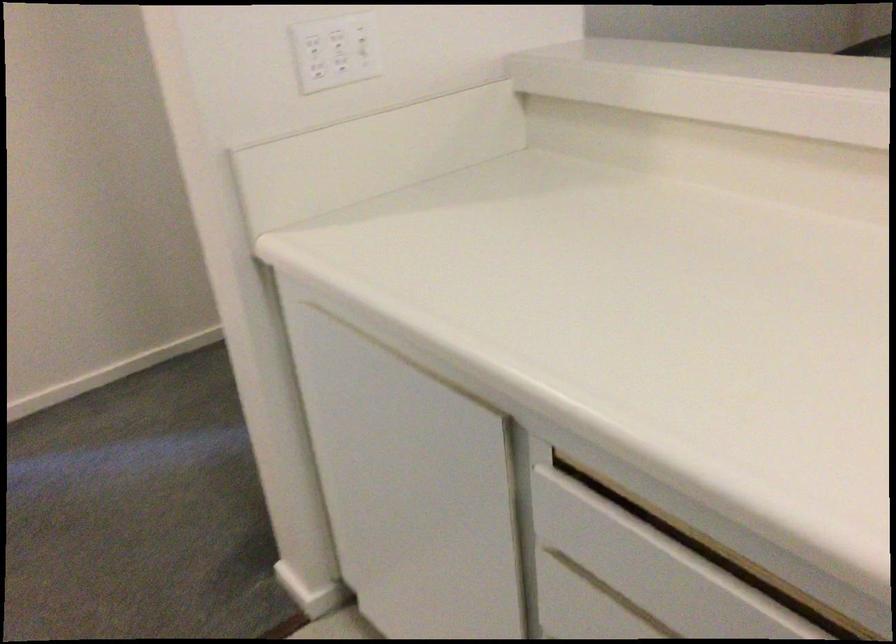
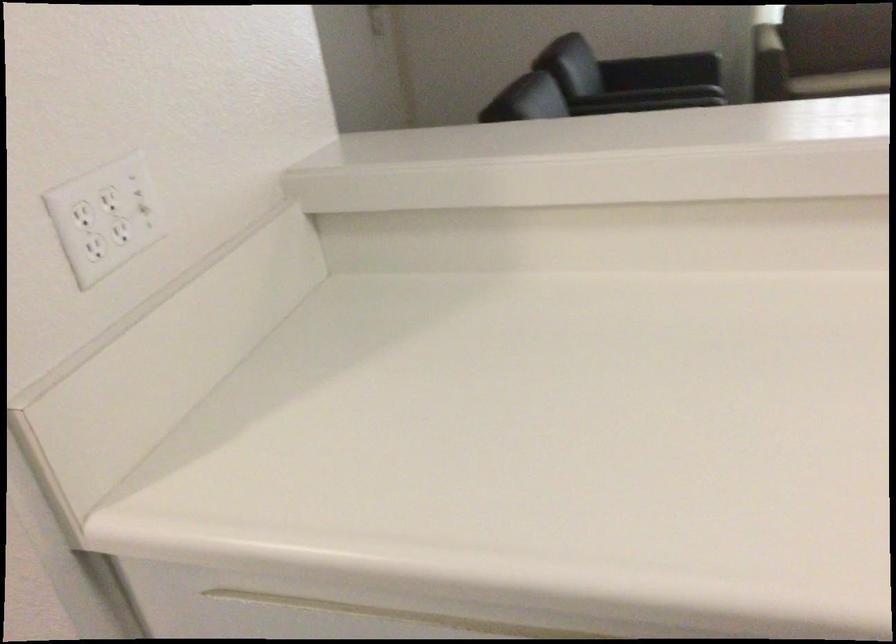
Question: Based on the continuous images, in which direction is the camera rotating? Reply with the corresponding letter.

Choices:
 (A) Left
 (B) Right
 (C) Up
 (D) Down

Answer: (B)